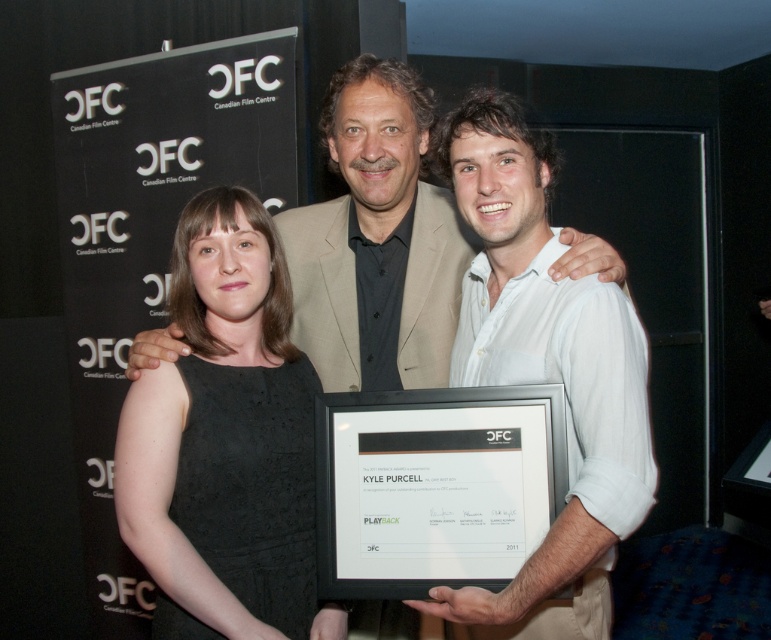
You are organizing a charity event and need to decide which outfit to display in a small showcase. Given the black textured dress at left and the light beige suit at center, which one would fit better in a display case that can only accommodate smaller items?

The black textured dress at left has a smaller size compared to the light beige suit at center, so it would fit better in the display case designed for smaller items.